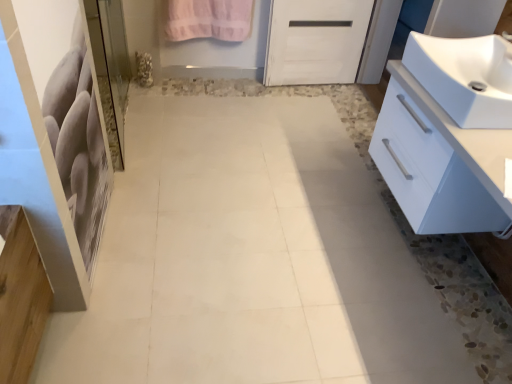
Describe the element at coordinates (439, 162) in the screenshot. This screenshot has width=512, height=384. I see `white glossy cabinet at right` at that location.

In order to click on clear glass screen door at left in this screenshot , I will do `click(110, 69)`.

Where is `white glossy cabinet at right`? white glossy cabinet at right is located at coordinates (439, 162).

In the scene shown: Does pink cotton towel at upper center have a lesser height compared to white glossy sink at right?

No, pink cotton towel at upper center is not shorter than white glossy sink at right.

Is pink cotton towel at upper center facing away from white glossy sink at right?

pink cotton towel at upper center is not turned away from white glossy sink at right.

Between pink cotton towel at upper center and white glossy sink at right, which one has larger size?

white glossy sink at right.

The height and width of the screenshot is (384, 512). Find the location of `bath towel above the white glossy sink at right (from the image's perspective)`. bath towel above the white glossy sink at right (from the image's perspective) is located at coordinates (209, 19).

How different are the orientations of white glossy sink at right and pink cotton towel at upper center in degrees?

The angle between the facing direction of white glossy sink at right and the facing direction of pink cotton towel at upper center is 92 degrees.

Looking at this image, would you say pink cotton towel at upper center is part of white glossy sink at right's contents?

No, pink cotton towel at upper center is located outside of white glossy sink at right.

In the image, is white glossy sink at right positioned in front of or behind pink cotton towel at upper center?

In the image, white glossy sink at right appears in front of pink cotton towel at upper center.

Is white glossy sink at right taller or shorter than pink cotton towel at upper center?

Considering their sizes, white glossy sink at right has less height than pink cotton towel at upper center.

Based on the photo, are white glossy cabinet at right and clear glass screen door at left beside each other?

No, white glossy cabinet at right is not beside clear glass screen door at left.

Is white glossy cabinet at right inside the boundaries of clear glass screen door at left, or outside?

white glossy cabinet at right is outside clear glass screen door at left.

Based on the photo, is white glossy cabinet at right facing away from clear glass screen door at left?

That's not correct — white glossy cabinet at right is not looking away from clear glass screen door at left.

Is point (454, 122) less distant than point (105, 1)?

Yes, it is.

Which is correct: clear glass screen door at left is inside white glossy sink at right, or outside of it?

clear glass screen door at left cannot be found inside white glossy sink at right.

Is clear glass screen door at left far away from white glossy sink at right?

Yes, clear glass screen door at left and white glossy sink at right are quite far apart.

Can you confirm if clear glass screen door at left is positioned to the right of white glossy sink at right?

No.

Which object is more forward, clear glass screen door at left or white glossy sink at right?

Positioned in front is white glossy sink at right.

Is pink cotton towel at upper center bigger than white glossy cabinet at right?

No.

From a real-world perspective, which is physically below, pink cotton towel at upper center or white glossy cabinet at right?

pink cotton towel at upper center, from a real-world perspective.

Is point (191, 15) behind point (423, 218)?

Yes, it is.

Looking at this image, is pink cotton towel at upper center aimed at white glossy cabinet at right?

Yes, pink cotton towel at upper center is turned towards white glossy cabinet at right.

Does white glossy cabinet at right touch pink cotton towel at upper center?

white glossy cabinet at right is not next to pink cotton towel at upper center, and they're not touching.

From the image's perspective, is white glossy cabinet at right above or below pink cotton towel at upper center?

From the image's perspective, white glossy cabinet at right appears below pink cotton towel at upper center.

Is point (441, 221) farther from camera compared to point (218, 19)?

No, (441, 221) is closer to viewer.

Who is smaller, white glossy cabinet at right or pink cotton towel at upper center?

pink cotton towel at upper center is smaller.

Considering the positions of point (390, 127) and point (481, 71), is point (390, 127) closer or farther from the camera than point (481, 71)?

Point (390, 127) is farther from the camera than point (481, 71).

From a real-world perspective, relative to white glossy sink at right, is white glossy cabinet at right vertically above or below?

Clearly, from a real-world perspective, white glossy cabinet at right is below white glossy sink at right.

Is white glossy cabinet at right smaller than white glossy sink at right?

Incorrect, white glossy cabinet at right is not smaller in size than white glossy sink at right.

Which of these two, white glossy cabinet at right or white glossy sink at right, stands taller?

With more height is white glossy cabinet at right.

The image size is (512, 384). What are the coordinates of `bath towel behind the white glossy sink at right` in the screenshot? It's located at (209, 19).

The image size is (512, 384). Identify the location of bath towel above the white glossy sink at right (from the image's perspective). (209, 19).

Which object lies further to the anchor point white glossy sink at right, clear glass screen door at left or pink cotton towel at upper center?

pink cotton towel at upper center lies further to white glossy sink at right than the other object.

Looking at the image, which one is located further to white glossy sink at right, clear glass screen door at left or white glossy cabinet at right?

clear glass screen door at left is further to white glossy sink at right.

From the image, which object appears to be nearer to pink cotton towel at upper center, clear glass screen door at left or white glossy cabinet at right?

clear glass screen door at left.

Which object lies further to the anchor point white glossy cabinet at right, white glossy sink at right or pink cotton towel at upper center?

pink cotton towel at upper center is positioned further to the anchor white glossy cabinet at right.

In the scene shown: Estimate the real-world distances between objects in this image. Which object is further from pink cotton towel at upper center, white glossy sink at right or clear glass screen door at left?

The object further to pink cotton towel at upper center is white glossy sink at right.

When comparing their distances from white glossy sink at right, does white glossy cabinet at right or clear glass screen door at left seem further?

clear glass screen door at left is further to white glossy sink at right.

From the image, which object appears to be farther from white glossy cabinet at right, clear glass screen door at left or white glossy sink at right?

Among the two, clear glass screen door at left is located further to white glossy cabinet at right.

Based on their spatial positions, is white glossy cabinet at right or white glossy sink at right closer to pink cotton towel at upper center?

white glossy sink at right.

Locate an element on the screen. The width and height of the screenshot is (512, 384). sink between white glossy cabinet at right and pink cotton towel at upper center from front to back is located at coordinates click(465, 77).

The height and width of the screenshot is (384, 512). Find the location of `bathroom cabinet between clear glass screen door at left and white glossy sink at right from left to right`. bathroom cabinet between clear glass screen door at left and white glossy sink at right from left to right is located at coordinates (439, 162).

You are a GUI agent. You are given a task and a screenshot of the screen. Output one action in this format:
    pyautogui.click(x=<x>, y=<y>)
    Task: Click on the screen door positioned between white glossy cabinet at right and pink cotton towel at upper center from near to far
    
    Given the screenshot: What is the action you would take?
    pyautogui.click(x=110, y=69)

Identify the location of bath towel between clear glass screen door at left and white glossy sink at right from left to right. (209, 19).